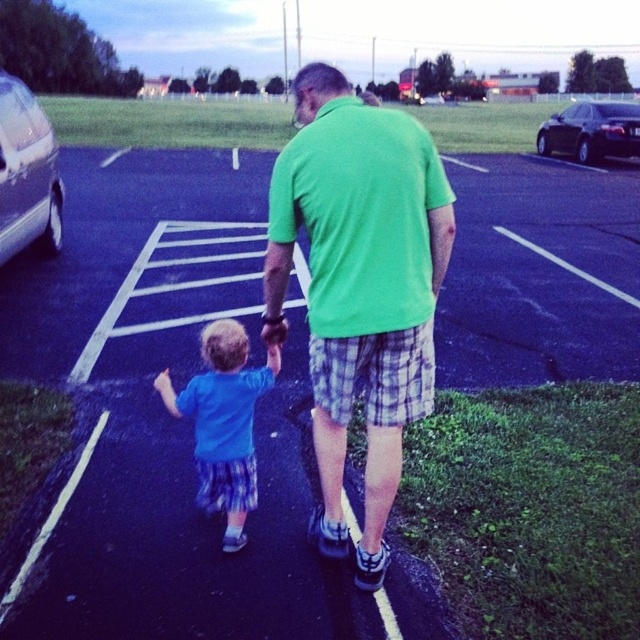
Question: Is blue cotton shirt at center further to the viewer compared to silver metallic car at left?

Choices:
 (A) yes
 (B) no

Answer: (B)

Question: Is blue cotton shirt at center bigger than silver metallic car at left?

Choices:
 (A) yes
 (B) no

Answer: (A)

Question: Is green fabric shirt at center thinner than blue cotton shirt at center?

Choices:
 (A) no
 (B) yes

Answer: (A)

Question: Which object is the farthest from the shiny black sedan at upper right?

Choices:
 (A) silver metallic car at left
 (B) blue cotton shirt at center

Answer: (A)

Question: Among these objects, which one is nearest to the camera?

Choices:
 (A) blue cotton shirt at center
 (B) silver metallic car at left
 (C) shiny black sedan at upper right

Answer: (A)

Question: Which object is closer to the camera taking this photo?

Choices:
 (A) blue cotton shirt at center
 (B) green fabric shirt at center

Answer: (B)